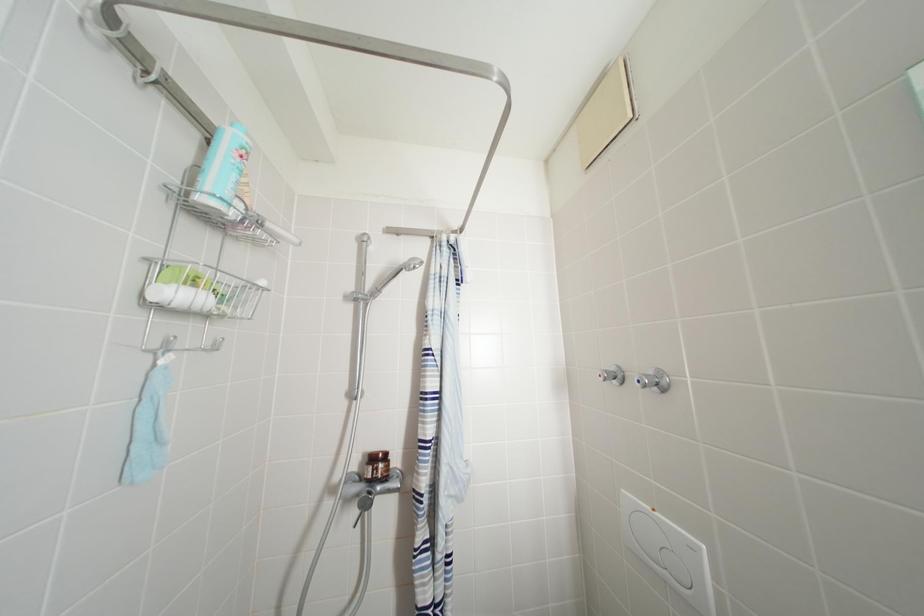
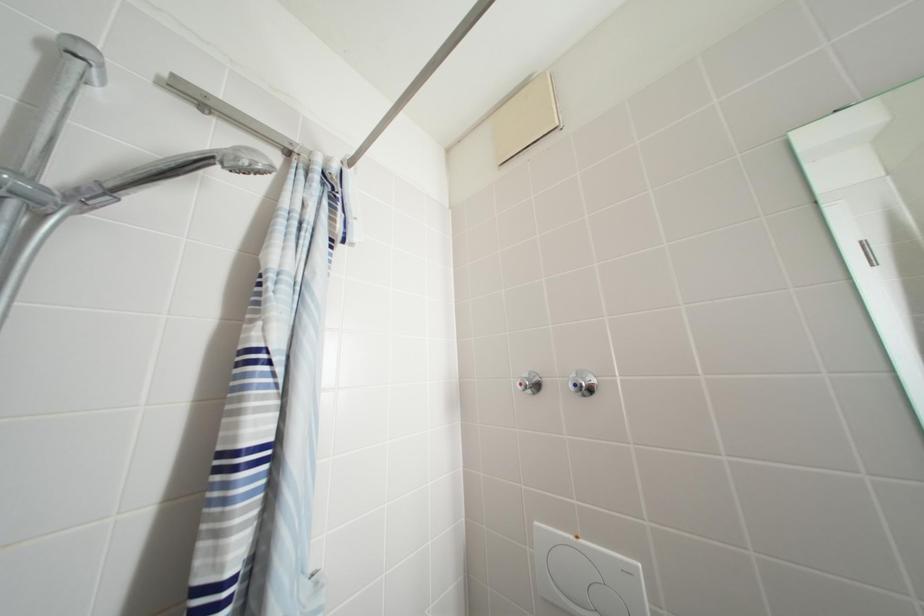
Question: How did the camera likely rotate?

Choices:
 (A) Left
 (B) Right
 (C) Up
 (D) Down

Answer: (B)